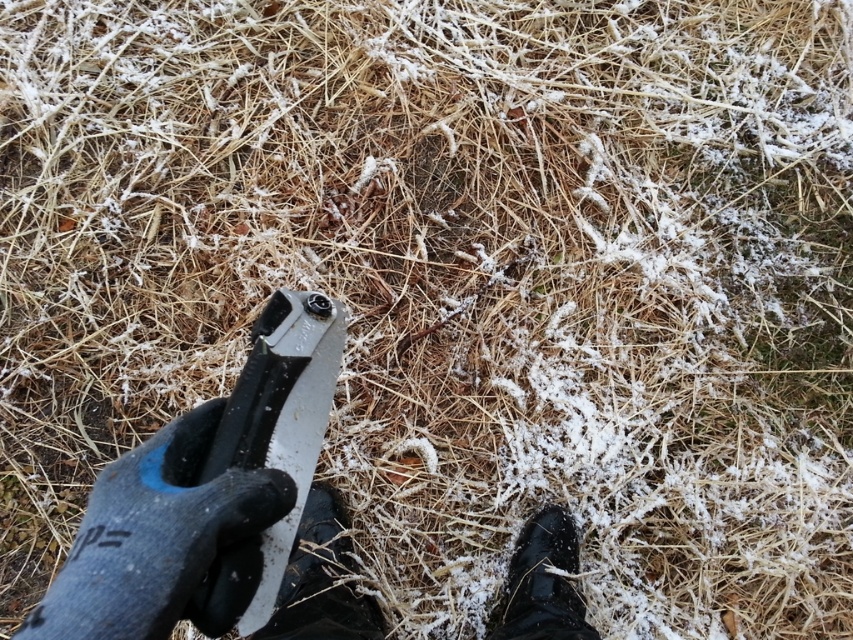
You are standing at the origin point of the image coordinate system. The image coordinate system has its origin at the lower left corner of the image. You want to place a new object at the same position as the black rubber shoe at lower center. What are the coordinates where you should place the new object?

The coordinates for the black rubber shoe at lower center are at point [321,579]. Therefore, you should place the new object at coordinates [321,579].

You are a repair technician working in cold weather. You need to place a 50 cm long tool on the ground between the black rubber glove at lower left and the metallic silver pliers at center. Can the tool fit between them without overlapping either object?

The black rubber glove at lower left and metallic silver pliers at center are 54.23 centimeters apart from each other. Since the tool is 50 cm long, it can fit between them without overlapping as 50 cm is less than 54.23 cm.

You are trying to decide which shoe to wear for a walk in the frosty ground. The black rubber shoe at lower center and the black leather shoe at lower right are both options. Based on their positions in the image, which one is more likely to have better traction on the frosty ground?

The black rubber shoe at lower center is more likely to have better traction on the frosty ground because rubber generally provides better grip on slippery surfaces compared to leather.